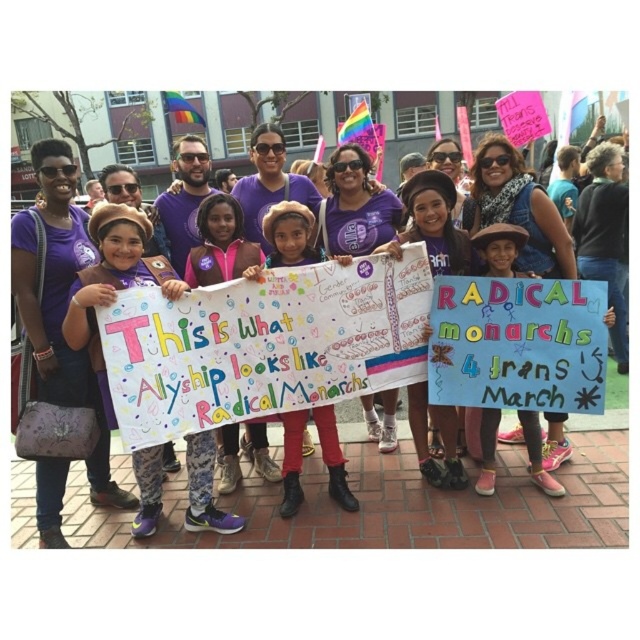
Can you confirm if white paper sign at center is taller than blue cardboard sign at center?

No, white paper sign at center is not taller than blue cardboard sign at center.

Can you confirm if white paper sign at center is thinner than blue cardboard sign at center?

Yes.

Locate an element on the screen. white paper sign at center is located at coordinates (220, 243).

The image size is (640, 640). What do you see at coordinates (401, 499) in the screenshot?
I see `purple fabric shirt at center` at bounding box center [401, 499].

Does purple fabric shirt at center have a greater height compared to matte cardboard sign at center?

Indeed, purple fabric shirt at center has a greater height compared to matte cardboard sign at center.

Is point (600, 532) positioned in front of point (269, 212)?

Yes, point (600, 532) is in front of point (269, 212).

I want to click on purple fabric shirt at center, so click(401, 499).

Is matte purple hat at center positioned before white paper sign at center?

Yes, matte purple hat at center is in front of white paper sign at center.

What do you see at coordinates (113, 282) in the screenshot? I see `matte purple hat at center` at bounding box center [113, 282].

The width and height of the screenshot is (640, 640). I want to click on matte purple hat at center, so click(x=113, y=282).